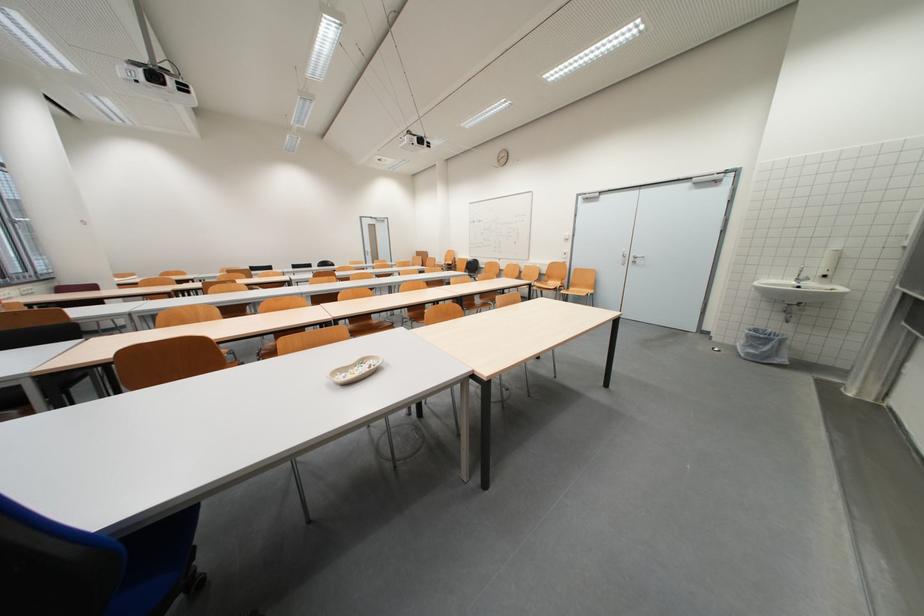
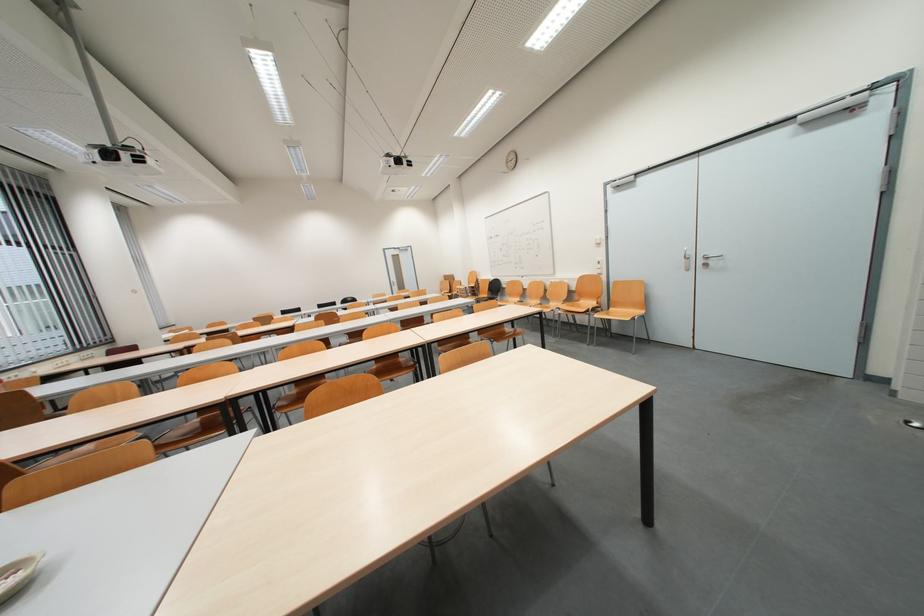
In the second image, find the point that corresponds to the point at 553,284 in the first image.

(582, 302)